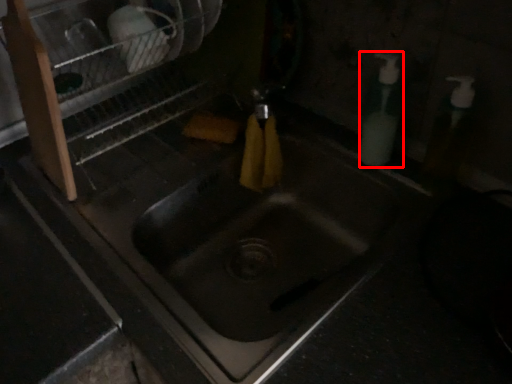
Question: Considering the relative positions of soap dispenser (annotated by the red box) and dish washer in the image provided, where is soap dispenser (annotated by the red box) located with respect to the staircase?

Choices:
 (A) right
 (B) left

Answer: (A)